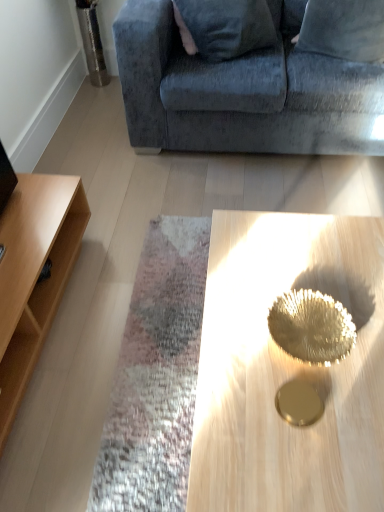
Locate an element on the screen. The width and height of the screenshot is (384, 512). free area in between velvet blue couch at upper center and light wood shelf at left is located at coordinates (161, 241).